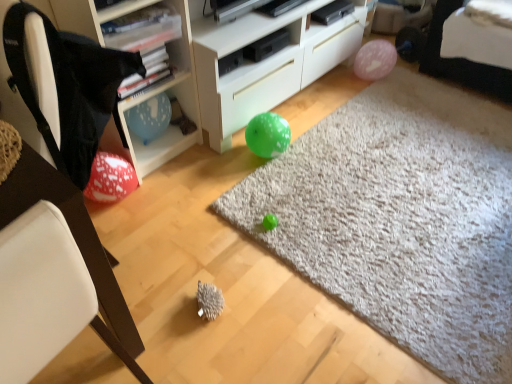
Locate an element on the screen. The height and width of the screenshot is (384, 512). vacant area located to the right-hand side of white plastic chair at left is located at coordinates (204, 278).